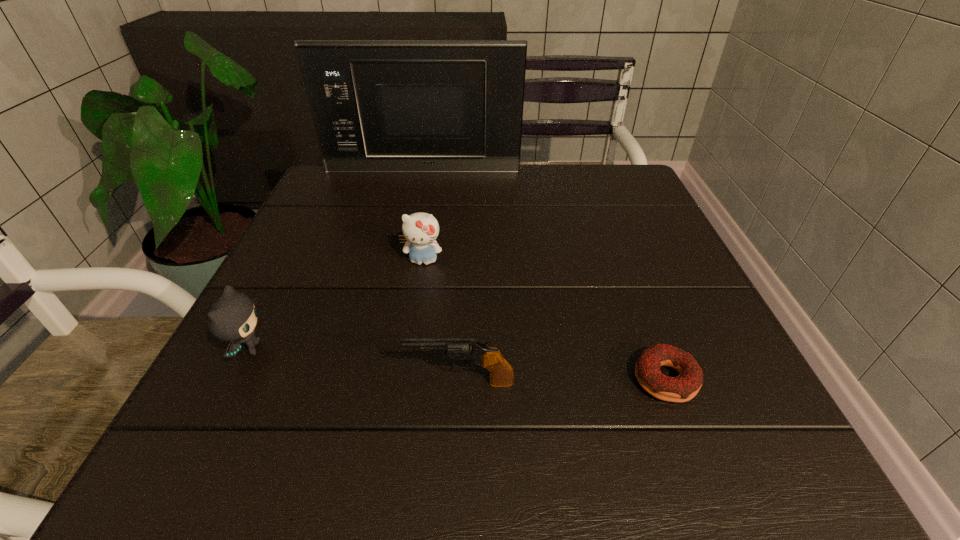
Where is `vacant region between the tallest object and the nearer kitten`? The image size is (960, 540). vacant region between the tallest object and the nearer kitten is located at coordinates (336, 260).

Where is `unoccupied area between the nearer kitten and the tallest object`? This screenshot has width=960, height=540. unoccupied area between the nearer kitten and the tallest object is located at coordinates (336, 260).

Locate an element on the screen. Image resolution: width=960 pixels, height=540 pixels. free area in between the gun and the farther kitten is located at coordinates (442, 321).

Image resolution: width=960 pixels, height=540 pixels. I want to click on blank region between the farther kitten and the doughnut, so click(x=544, y=320).

Where is `object that is the closest to the tallest object`? The height and width of the screenshot is (540, 960). object that is the closest to the tallest object is located at coordinates (420, 229).

This screenshot has height=540, width=960. In order to click on object that is the fourth nearest to the fourth nearest object in this screenshot , I will do pyautogui.click(x=682, y=388).

This screenshot has width=960, height=540. In order to click on free space that satisfies the following two spatial constraints: 1. on the front-facing side of the left kitten; 2. along the barrel of the gun in this screenshot , I will do `click(232, 382)`.

This screenshot has height=540, width=960. Find the location of `free spot that satisfies the following two spatial constraints: 1. on the front panel of the doughnut; 2. on the left side of the farthest object`. free spot that satisfies the following two spatial constraints: 1. on the front panel of the doughnut; 2. on the left side of the farthest object is located at coordinates (380, 380).

Image resolution: width=960 pixels, height=540 pixels. Find the location of `vacant position in the image that satisfies the following two spatial constraints: 1. along the barrel of the gun; 2. on the front-facing side of the left kitten`. vacant position in the image that satisfies the following two spatial constraints: 1. along the barrel of the gun; 2. on the front-facing side of the left kitten is located at coordinates (462, 349).

Where is `free space that satisfies the following two spatial constraints: 1. on the front-facing side of the farther kitten; 2. on the front-facing side of the left kitten`? The height and width of the screenshot is (540, 960). free space that satisfies the following two spatial constraints: 1. on the front-facing side of the farther kitten; 2. on the front-facing side of the left kitten is located at coordinates (410, 349).